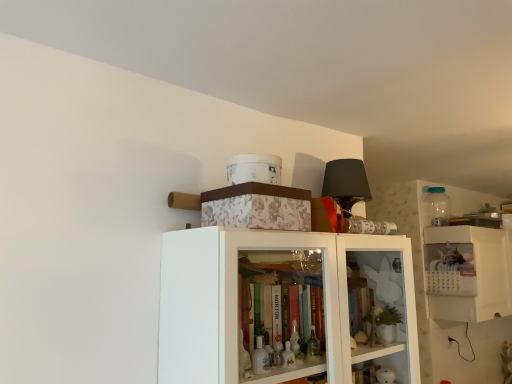
What is the approximate height of white floral-patterned box at upper center?

white floral-patterned box at upper center is 12.52 centimeters in height.

What do you see at coordinates (468, 273) in the screenshot?
I see `white plastic calendar at upper right` at bounding box center [468, 273].

Where is `white plastic calendar at upper right`? white plastic calendar at upper right is located at coordinates (468, 273).

What do you see at coordinates (436, 207) in the screenshot? I see `transparent plastic bottle at upper right` at bounding box center [436, 207].

Looking at this image, measure the distance between transparent plastic bottle at upper right and camera.

transparent plastic bottle at upper right and camera are 2.99 meters apart from each other.

Locate an element on the screen. white floral-patterned box at upper center is located at coordinates (257, 207).

Which is closer, (463,250) or (256,204)?

The point (256,204) is closer to the camera.

Considering the positions of objects white plastic calendar at upper right and white floral-patterned box at upper center in the image provided, who is more to the right, white plastic calendar at upper right or white floral-patterned box at upper center?

white plastic calendar at upper right is more to the right.

Would you say white plastic calendar at upper right is inside or outside white floral-patterned box at upper center?

white plastic calendar at upper right exists outside the volume of white floral-patterned box at upper center.

This screenshot has height=384, width=512. I want to click on cabinetry on the right of white floral-patterned box at upper center, so click(x=468, y=273).

From the picture: Does white floral-patterned box at upper center have a greater height compared to transparent plastic bottle at upper right?

Incorrect, the height of white floral-patterned box at upper center is not larger of that of transparent plastic bottle at upper right.

From a real-world perspective, is white floral-patterned box at upper center positioned over transparent plastic bottle at upper right based on gravity?

Actually, white floral-patterned box at upper center is physically below transparent plastic bottle at upper right in the real world.

Considering the relative positions of white floral-patterned box at upper center and transparent plastic bottle at upper right in the image provided, is white floral-patterned box at upper center to the right of transparent plastic bottle at upper right from the viewer's perspective?

No.

How many degrees apart are the facing directions of white floral-patterned box at upper center and transparent plastic bottle at upper right?

There is a 9.28-degree angle between the facing directions of white floral-patterned box at upper center and transparent plastic bottle at upper right.

Is transparent plastic bottle at upper right not close to white plastic calendar at upper right?

transparent plastic bottle at upper right is actually quite close to white plastic calendar at upper right.

Considering their positions, is transparent plastic bottle at upper right located in front of or behind white plastic calendar at upper right?

transparent plastic bottle at upper right is positioned farther from the viewer than white plastic calendar at upper right.

Based on their sizes in the image, would you say transparent plastic bottle at upper right is bigger or smaller than white plastic calendar at upper right?

Clearly, transparent plastic bottle at upper right is smaller in size than white plastic calendar at upper right.

From the image's perspective, is transparent plastic bottle at upper right above or below white plastic calendar at upper right?

From the image's perspective, transparent plastic bottle at upper right appears above white plastic calendar at upper right.

Can you confirm if white plastic calendar at upper right is thinner than transparent plastic bottle at upper right?

No.

Where is `cabinetry that is below the transparent plastic bottle at upper right (from the image's perspective)`? The image size is (512, 384). cabinetry that is below the transparent plastic bottle at upper right (from the image's perspective) is located at coordinates (468, 273).

From a real-world perspective, is white plastic calendar at upper right positioned above or below transparent plastic bottle at upper right?

From a real-world perspective, white plastic calendar at upper right is physically below transparent plastic bottle at upper right.

Considering the sizes of objects white plastic calendar at upper right and transparent plastic bottle at upper right in the image provided, who is smaller, white plastic calendar at upper right or transparent plastic bottle at upper right?

transparent plastic bottle at upper right.

Which of these two, white floral-patterned box at upper center or white plastic calendar at upper right, stands shorter?

white floral-patterned box at upper center.

How many degrees apart are the facing directions of white floral-patterned box at upper center and white plastic calendar at upper right?

2.64 degrees.

Does white floral-patterned box at upper center turn towards white plastic calendar at upper right?

No, white floral-patterned box at upper center is not facing towards white plastic calendar at upper right.

Would you say white floral-patterned box at upper center is inside or outside white plastic calendar at upper right?

The correct answer is: outside.

Does transparent plastic bottle at upper right appear on the right side of white floral-patterned box at upper center?

Correct, you'll find transparent plastic bottle at upper right to the right of white floral-patterned box at upper center.

Does transparent plastic bottle at upper right have a lesser width compared to white floral-patterned box at upper center?

Correct, the width of transparent plastic bottle at upper right is less than that of white floral-patterned box at upper center.

Is transparent plastic bottle at upper right facing towards white floral-patterned box at upper center?

No, transparent plastic bottle at upper right is not facing towards white floral-patterned box at upper center.

Which point is more distant from viewer, [445,216] or [302,191]?

Point [445,216]

I want to click on box located in front of the white plastic calendar at upper right, so click(x=257, y=207).

The width and height of the screenshot is (512, 384). Identify the location of bottle that appears behind the white floral-patterned box at upper center. (436, 207).

Looking at the image, which one is located closer to white floral-patterned box at upper center, white plastic calendar at upper right or transparent plastic bottle at upper right?

white plastic calendar at upper right.

Looking at the image, which one is located closer to transparent plastic bottle at upper right, white floral-patterned box at upper center or white plastic calendar at upper right?

white plastic calendar at upper right.

Considering their positions, is white floral-patterned box at upper center positioned closer to white plastic calendar at upper right than transparent plastic bottle at upper right?

transparent plastic bottle at upper right is positioned closer to the anchor white plastic calendar at upper right.

From the picture: From the image, which object appears to be farther from transparent plastic bottle at upper right, white plastic calendar at upper right or white floral-patterned box at upper center?

white floral-patterned box at upper center.

Based on their spatial positions, is transparent plastic bottle at upper right or white floral-patterned box at upper center further from white plastic calendar at upper right?

white floral-patterned box at upper center.

From the image, which object appears to be farther from white floral-patterned box at upper center, transparent plastic bottle at upper right or white plastic calendar at upper right?

transparent plastic bottle at upper right is positioned further to the anchor white floral-patterned box at upper center.

Identify the location of cabinetry between white floral-patterned box at upper center and transparent plastic bottle at upper right along the z-axis. The width and height of the screenshot is (512, 384). (468, 273).